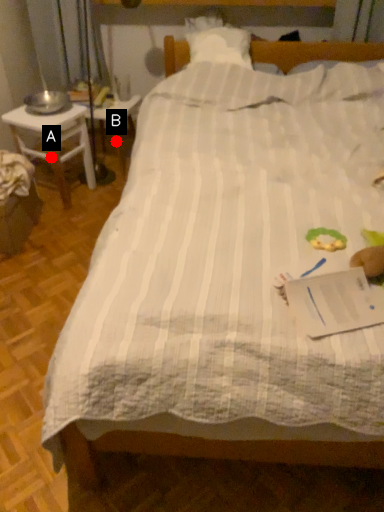
Question: Two points are circled on the image, labeled by A and B beside each circle. Which point is further to the camera?

Choices:
 (A) A is further
 (B) B is further

Answer: (B)